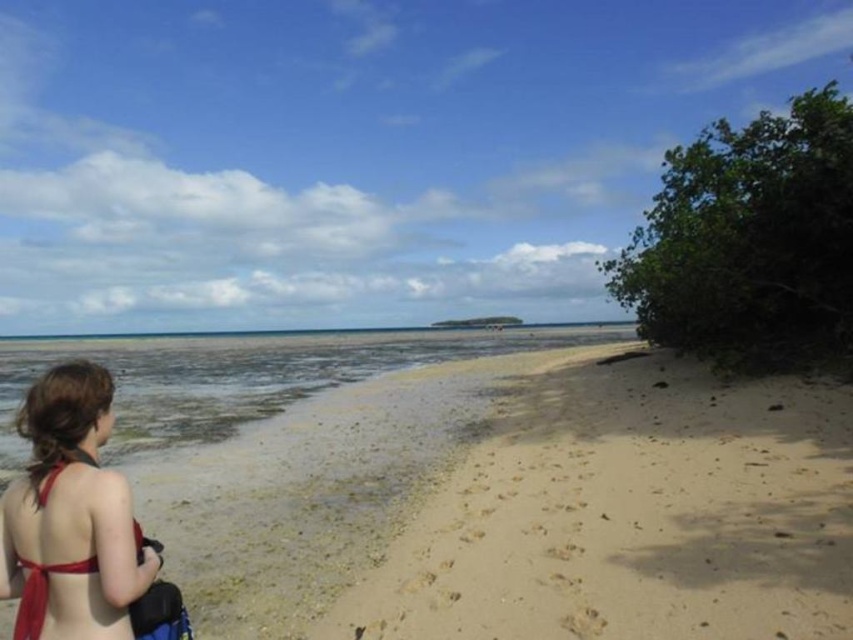
Does light tan sand at center have a larger size compared to red bikini at lower left?

Yes, light tan sand at center is bigger than red bikini at lower left.

Does light tan sand at center have a lesser width compared to red bikini at lower left?

Incorrect, light tan sand at center's width is not less than red bikini at lower left's.

This screenshot has height=640, width=853. In order to click on light tan sand at center in this screenshot , I will do `click(630, 515)`.

Measure the distance between light tan sand at center and camera.

light tan sand at center is 11.83 feet away from camera.

Is light tan sand at center thinner than clear water at lower left?

Yes, light tan sand at center is thinner than clear water at lower left.

I want to click on light tan sand at center, so click(630, 515).

Find the location of a particular element. This screenshot has height=640, width=853. light tan sand at center is located at coordinates (630, 515).

Does clear water at lower left have a smaller size compared to red bikini at lower left?

No, clear water at lower left is not smaller than red bikini at lower left.

Does clear water at lower left appear under red bikini at lower left?

Yes, clear water at lower left is below red bikini at lower left.

At what (x,y) coordinates should I click in order to perform the action: click on clear water at lower left. Please return your answer as a coordinate pair (x, y). The height and width of the screenshot is (640, 853). Looking at the image, I should click on (241, 376).